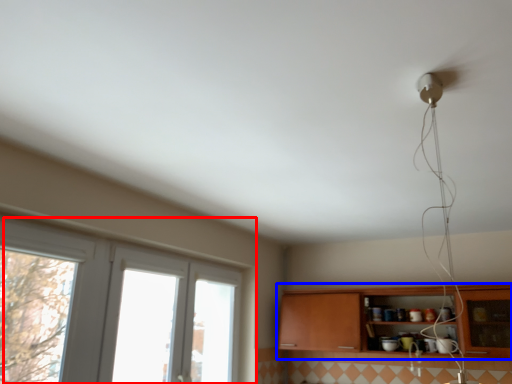
Question: Which object is further to the camera taking this photo, window (highlighted by a red box) or cabinetry (highlighted by a blue box)?

Choices:
 (A) window
 (B) cabinetry

Answer: (B)